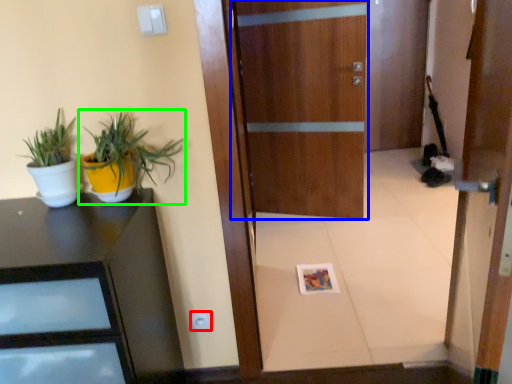
Question: Based on their relative distances, which object is nearer to electric outlet (highlighted by a red box)? Choose from door (highlighted by a blue box) and houseplant (highlighted by a green box).

Choices:
 (A) door
 (B) houseplant

Answer: (B)